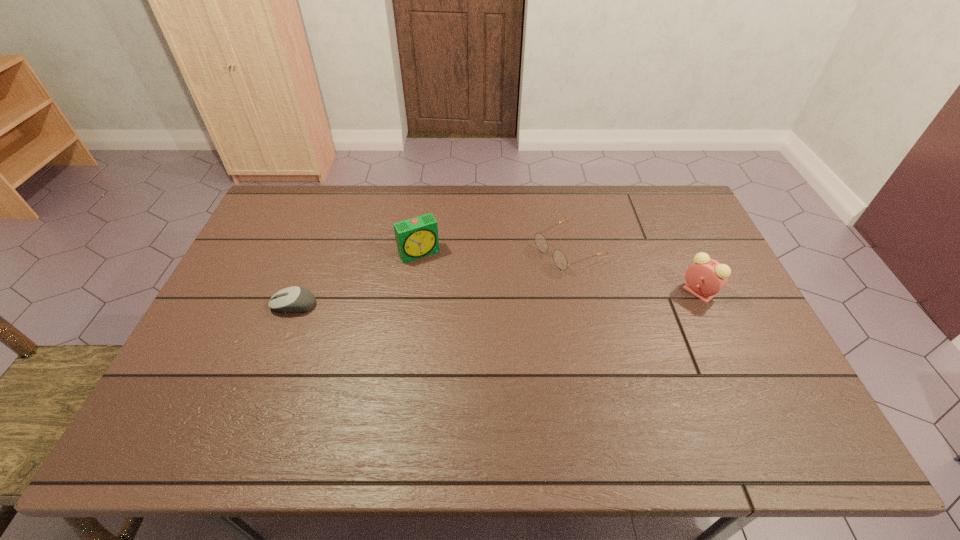
You are a GUI agent. You are given a task and a screenshot of the screen. Output one action in this format:
    pyautogui.click(x=<x>, y=<y>)
    Task: Click on the leftmost object
    The image size is (960, 540).
    Given the screenshot: What is the action you would take?
    pyautogui.click(x=295, y=299)

You are a GUI agent. You are given a task and a screenshot of the screen. Output one action in this format:
    pyautogui.click(x=<x>, y=<y>)
    Task: Click on the computer equipment
    This screenshot has height=540, width=960.
    Given the screenshot: What is the action you would take?
    pyautogui.click(x=295, y=299)

Identify the location of the right alarm clock. (705, 277).

You are a GUI agent. You are given a task and a screenshot of the screen. Output one action in this format:
    pyautogui.click(x=<x>, y=<y>)
    Task: Click on the nearer alarm clock
    This screenshot has width=960, height=540.
    Given the screenshot: What is the action you would take?
    pyautogui.click(x=705, y=277)

This screenshot has height=540, width=960. What are the coordinates of `spectacles` in the screenshot? It's located at (559, 258).

I want to click on the second shortest object, so click(559, 258).

In order to click on the second object from left to right in this screenshot , I will do `click(416, 238)`.

Where is `the left alarm clock`? The height and width of the screenshot is (540, 960). the left alarm clock is located at coordinates (416, 238).

Where is `vacant space located 0.110m on the wheel side of the leftmost object`? The width and height of the screenshot is (960, 540). vacant space located 0.110m on the wheel side of the leftmost object is located at coordinates (232, 305).

This screenshot has width=960, height=540. Identify the location of vacant space situated 0.050m on the face of the right alarm clock. (732, 292).